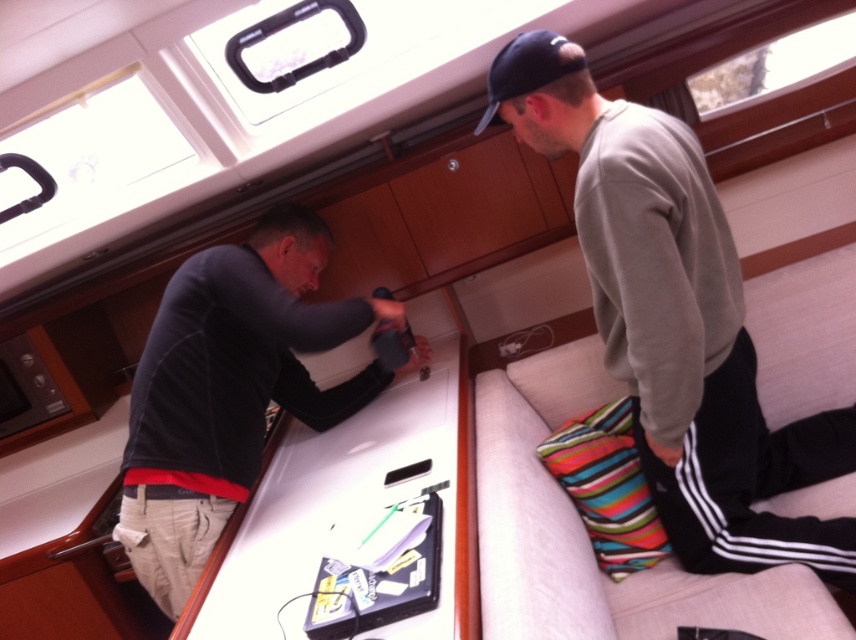
Question: Is light gray sweater at upper right to the right of black matte shirt at center from the viewer's perspective?

Choices:
 (A) no
 (B) yes

Answer: (B)

Question: Does light gray sweater at upper right have a lesser width compared to black matte shirt at center?

Choices:
 (A) yes
 (B) no

Answer: (B)

Question: Can you confirm if light gray sweater at upper right is wider than black matte shirt at center?

Choices:
 (A) yes
 (B) no

Answer: (A)

Question: Among these points, which one is nearest to the camera?

Choices:
 (A) (672, 538)
 (B) (251, 460)

Answer: (A)

Question: Which point is farther to the camera?

Choices:
 (A) light gray sweater at upper right
 (B) black matte shirt at center

Answer: (B)

Question: Which point is closer to the camera?

Choices:
 (A) (616, 305)
 (B) (324, 323)

Answer: (A)